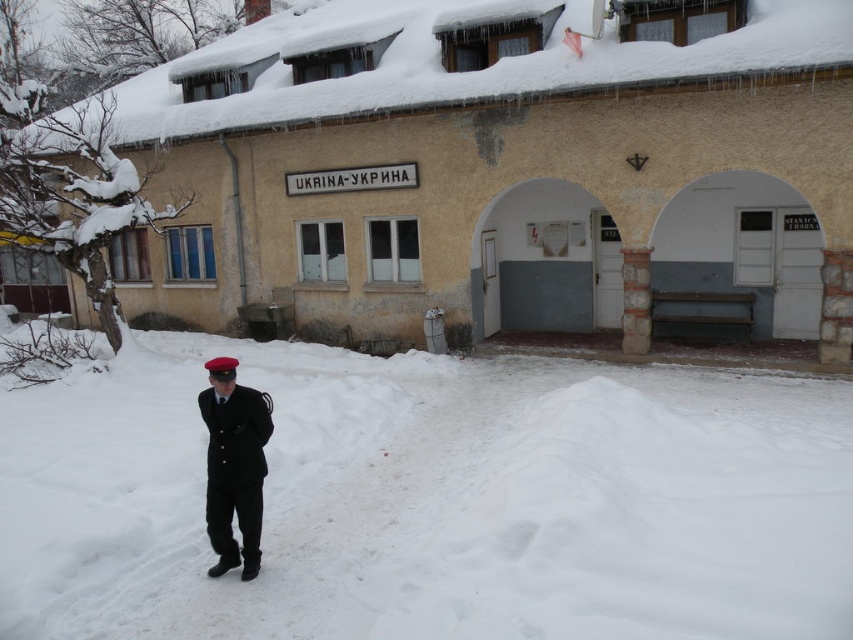
Question: Can you confirm if white fluffy snow at lower center is positioned to the right of black matte uniform at lower left?

Choices:
 (A) yes
 (B) no

Answer: (A)

Question: Where is white fluffy snow at lower center located in relation to black matte uniform at lower left in the image?

Choices:
 (A) above
 (B) below

Answer: (B)

Question: Which point is farther to the camera?

Choices:
 (A) white fluffy snow at lower center
 (B) black matte uniform at lower left

Answer: (B)

Question: Does white fluffy snow at lower center appear on the left side of black matte uniform at lower left?

Choices:
 (A) yes
 (B) no

Answer: (B)